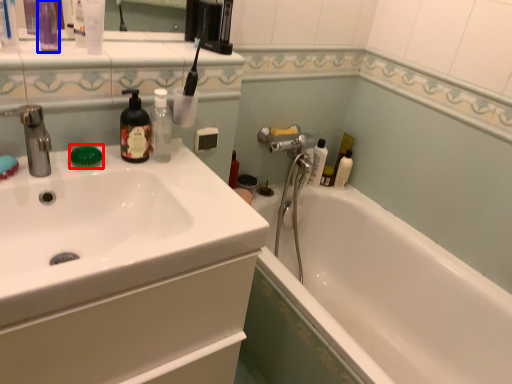
Question: Among these objects, which one is farthest to the camera, soap (highlighted by a red box) or toiletry (highlighted by a blue box)?

Choices:
 (A) soap
 (B) toiletry

Answer: (A)